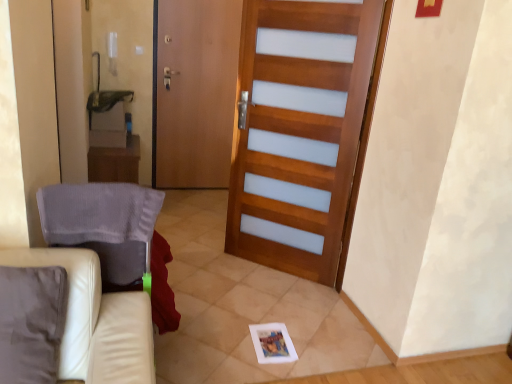
Locate an element on the screen. The height and width of the screenshot is (384, 512). free space in front of wooden barn door at center is located at coordinates (278, 338).